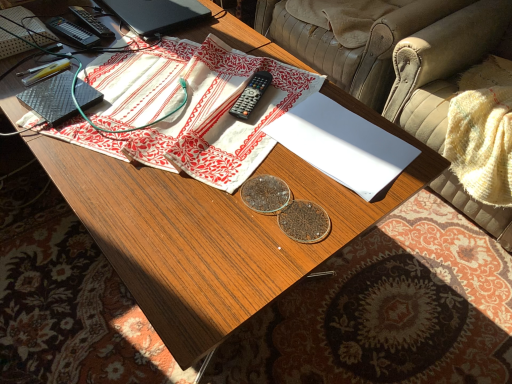
Image resolution: width=512 pixels, height=384 pixels. What are the coordinates of `vacant space that's between black plastic remote at center and white paper at center` in the screenshot? It's located at (279, 116).